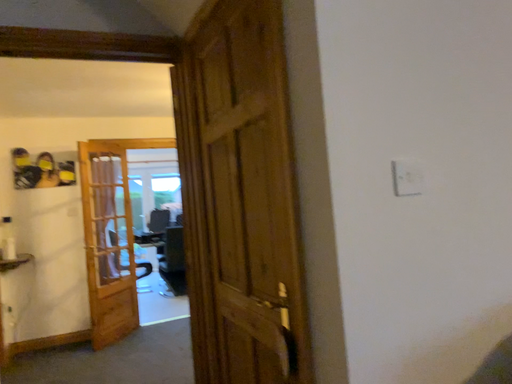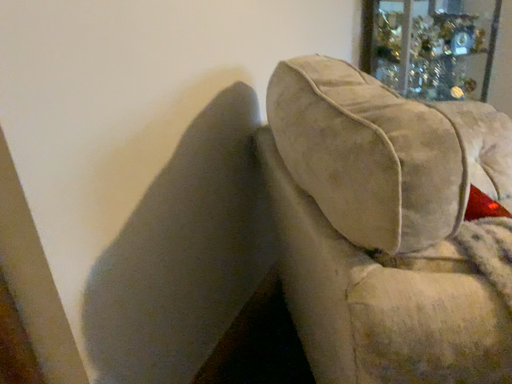
Question: Which way did the camera rotate in the video?

Choices:
 (A) rotated left
 (B) rotated right

Answer: (B)